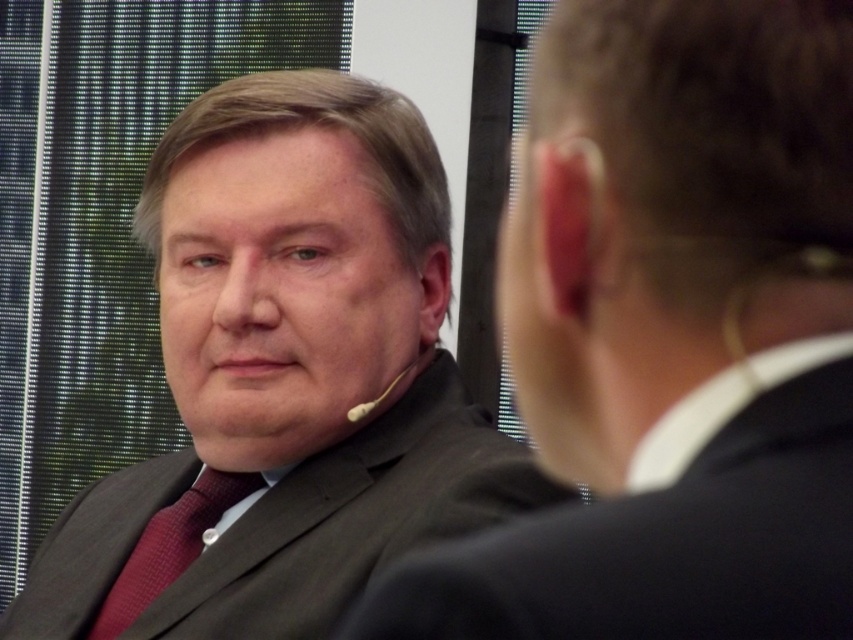
Question: Can you confirm if dark gray suit at left is smaller than matte black suit at center?

Choices:
 (A) no
 (B) yes

Answer: (B)

Question: Which object is positioned closest to the matte black suit at center?

Choices:
 (A) white plastic earbud at left
 (B) maroon textured tie at left

Answer: (B)

Question: Does maroon textured tie at left have a greater width compared to white plastic earbud at left?

Choices:
 (A) yes
 (B) no

Answer: (A)

Question: Which point is farther to the camera?

Choices:
 (A) (91, 627)
 (B) (825, 445)

Answer: (A)

Question: Is dark gray suit at left thinner than dark gray suit at center?

Choices:
 (A) no
 (B) yes

Answer: (A)

Question: Considering the real-world distances, which object is farthest from the dark gray suit at left?

Choices:
 (A) white plastic earbud at left
 (B) matte black suit at center
 (C) dark gray suit at center

Answer: (A)